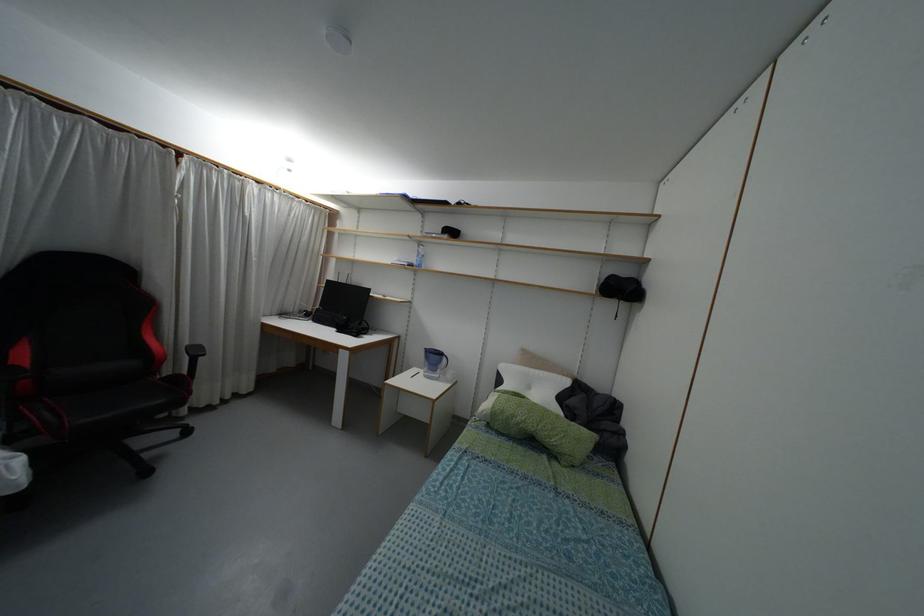
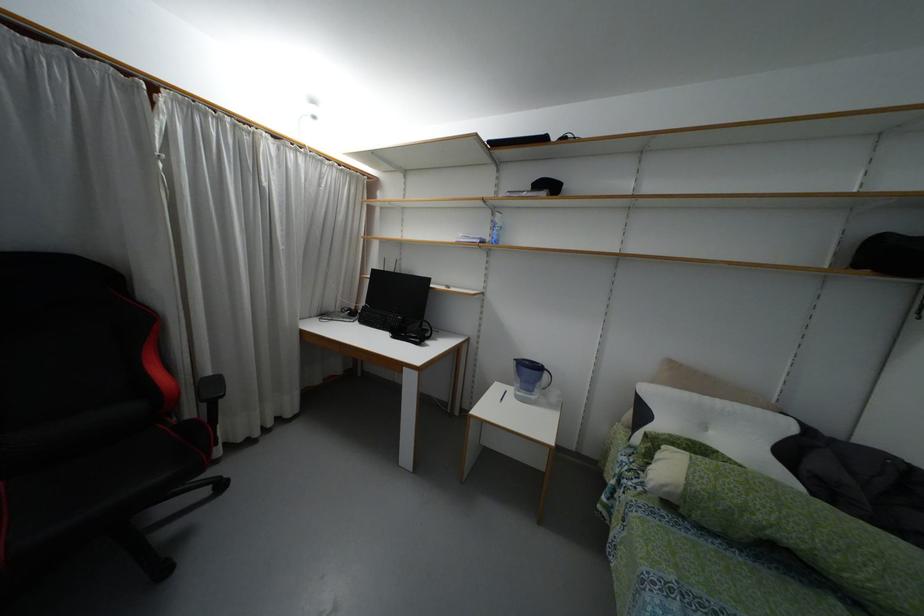
Find the pixel in the second image that matches (x=492, y=407) in the first image.

(687, 483)